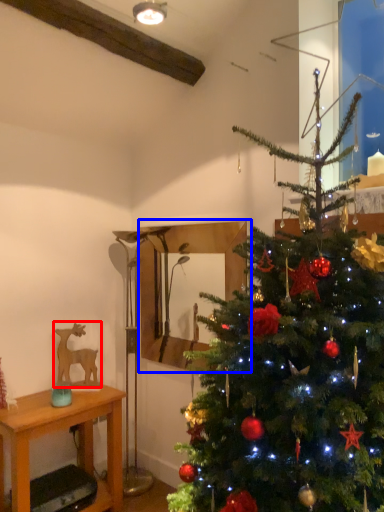
Question: Which object appears closest to the camera in this image, animal (highlighted by a red box) or mirror (highlighted by a blue box)?

Choices:
 (A) animal
 (B) mirror

Answer: (B)